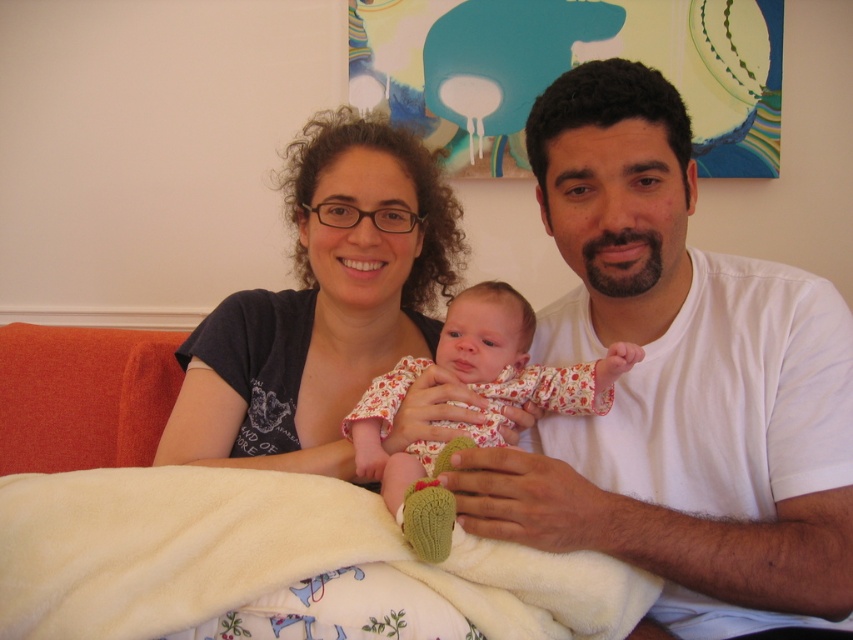
You are a photographer setting up a camera to take a portrait of the family. The camera has a focus area that can only accommodate objects of a certain width. You need to ensure that both the matte black shirt at center and the floral fabric baby at center are in focus. Given that the focus area width is exactly the same as the combined width of both objects, will the focus area be sufficient?

The matte black shirt at center is wider than the floral fabric baby at center. Since the focus area width matches their combined width, the total space required would exceed the focus area if the shirt alone is already wider than the baby. Therefore, the focus area may not be sufficient to capture both in focus.

What is the exact coordinate of the white cotton shirt at center?

The white cotton shirt at center is located at point [677,385].